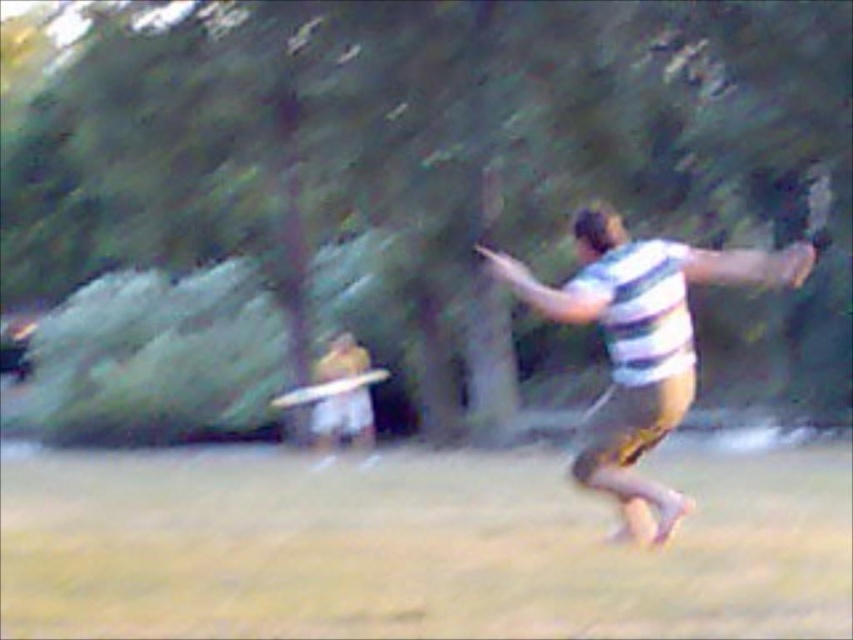
Between green grass at lower center and white matte frisbee at center, which one appears on the left side from the viewer's perspective?

Positioned to the left is white matte frisbee at center.

Between green grass at lower center and white matte frisbee at center, which one has more height?

With more height is white matte frisbee at center.

Who is more forward, (531, 568) or (315, 444)?

Point (531, 568) is more forward.

Find the location of a particular element. This screenshot has width=853, height=640. green grass at lower center is located at coordinates (415, 548).

Looking at this image, does green leafy tree at center have a greater width compared to green grass at lower center?

Correct, the width of green leafy tree at center exceeds that of green grass at lower center.

Consider the image. How far apart are green leafy tree at center and green grass at lower center?

8.76 meters

Which is behind, point (498, 396) or point (474, 509)?

The point (498, 396) is behind.

The width and height of the screenshot is (853, 640). In order to click on green leafy tree at center in this screenshot , I will do `click(403, 198)`.

Is green leafy tree at center positioned at the back of white matte frisbee at center?

No, green leafy tree at center is closer to the viewer.

Is the position of green leafy tree at center less distant than that of white matte frisbee at center?

Yes, green leafy tree at center is in front of white matte frisbee at center.

Which is behind, point (701, 310) or point (341, 413)?

Positioned behind is point (701, 310).

Identify the location of green leafy tree at center. Image resolution: width=853 pixels, height=640 pixels. (403, 198).